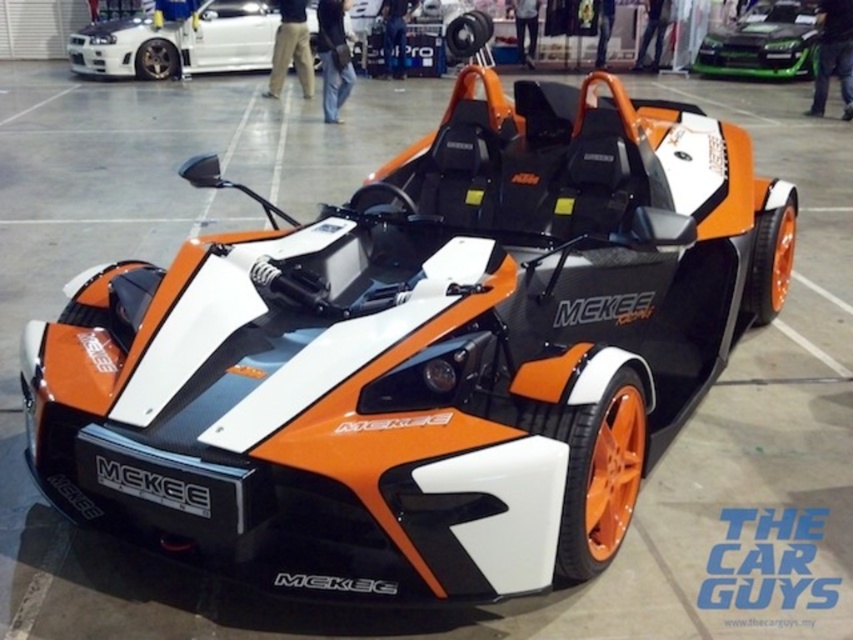
Question: Which of the following is the farthest from the observer?

Choices:
 (A) (784, 61)
 (B) (230, 12)

Answer: (B)

Question: Which point is closer to the camera taking this photo?

Choices:
 (A) (141, 49)
 (B) (711, 38)

Answer: (A)

Question: Is white glossy sedan at upper left to the left of green glossy car at upper center from the viewer's perspective?

Choices:
 (A) no
 (B) yes

Answer: (B)

Question: Is the position of white glossy sedan at upper left more distant than that of green glossy car at upper center?

Choices:
 (A) no
 (B) yes

Answer: (B)

Question: Is white glossy sedan at upper left above green glossy car at upper center?

Choices:
 (A) yes
 (B) no

Answer: (B)